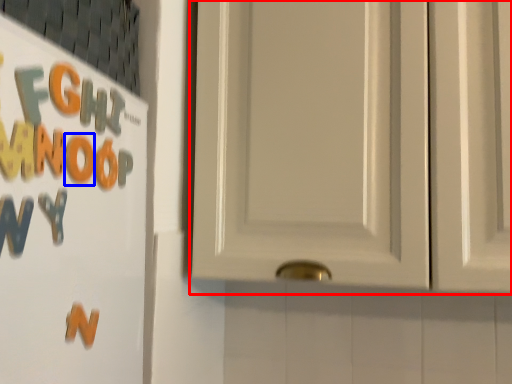
Question: Which point is further to the camera, door (highlighted by a red box) or letter (highlighted by a blue box)?

Choices:
 (A) door
 (B) letter

Answer: (A)